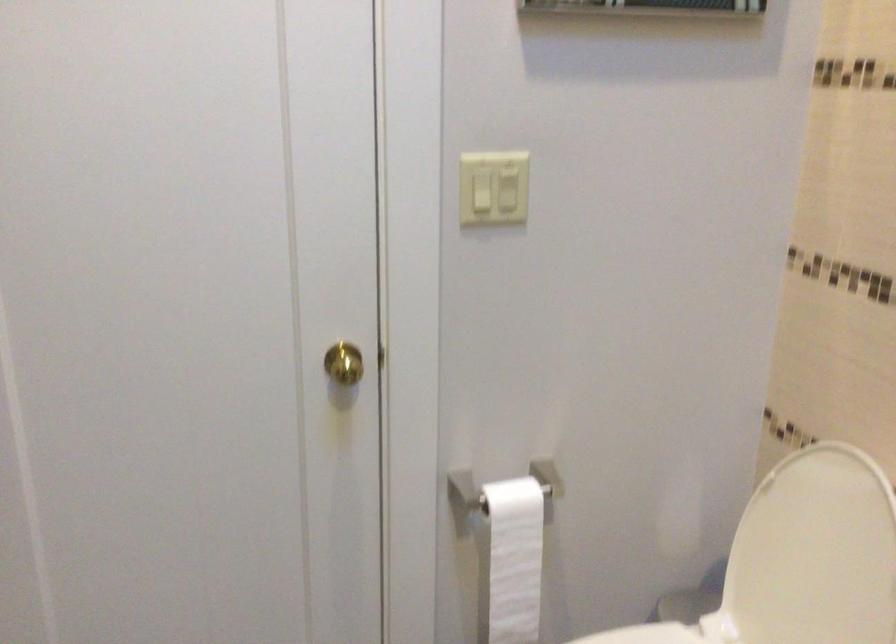
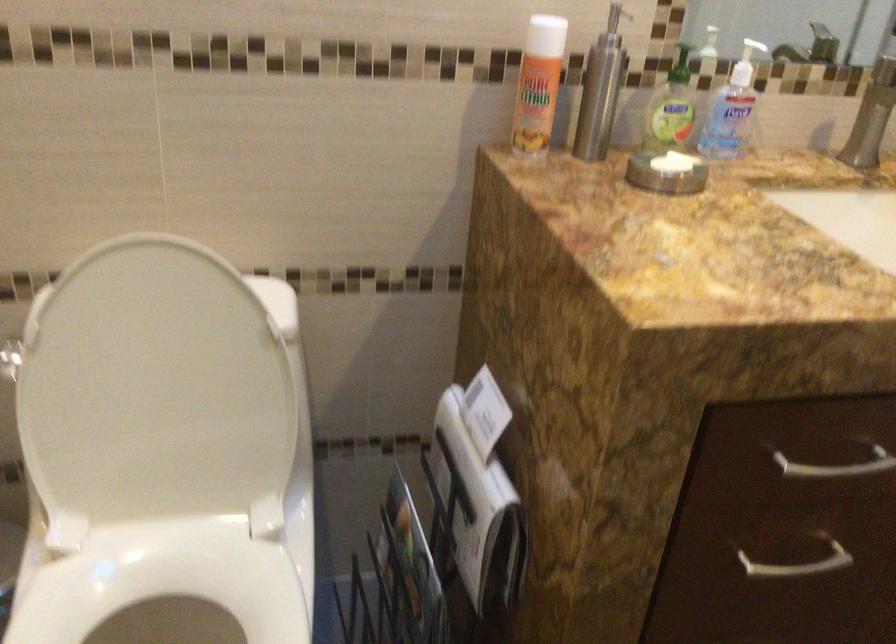
Where in the second image is the point corresponding to point (812, 569) from the first image?

(152, 391)